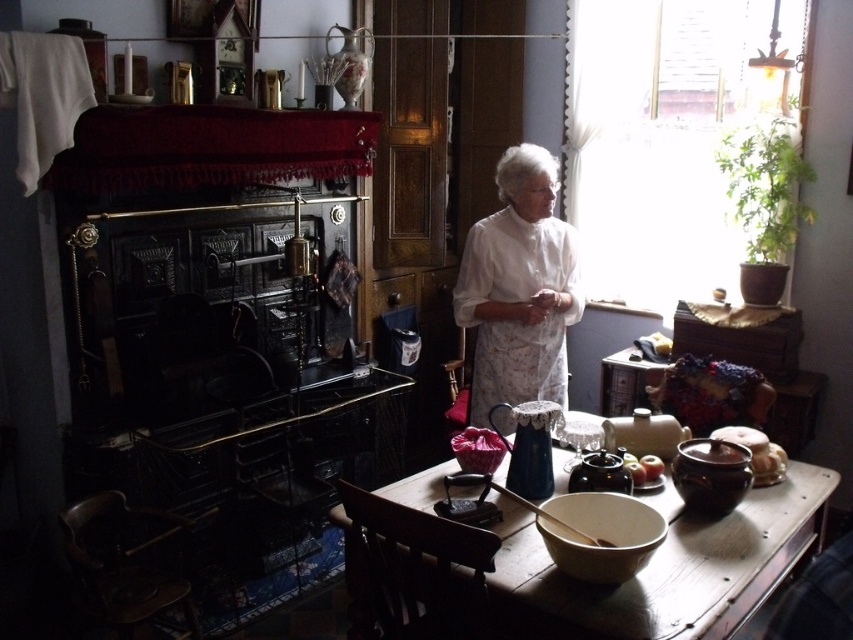
Who is shorter, matte wooden table at center or smooth brown bowl at lower center?

smooth brown bowl at lower center is shorter.

Which is in front, point (688, 579) or point (650, 454)?

Point (688, 579)

At what (x,y) coordinates should I click in order to perform the action: click on matte wooden table at center. Please return your answer as a coordinate pair (x, y). The height and width of the screenshot is (640, 853). Looking at the image, I should click on (665, 566).

Can you confirm if matte wooden table at center is positioned below white lace dress at center?

Yes, matte wooden table at center is below white lace dress at center.

Who is higher up, matte wooden table at center or white lace dress at center?

white lace dress at center

This screenshot has width=853, height=640. Describe the element at coordinates (665, 566) in the screenshot. I see `matte wooden table at center` at that location.

This screenshot has height=640, width=853. Find the location of `matte wooden table at center`. matte wooden table at center is located at coordinates (665, 566).

Can you confirm if white lace dress at center is smaller than smooth brown bowl at lower center?

Actually, white lace dress at center might be larger than smooth brown bowl at lower center.

Can you confirm if white lace dress at center is taller than smooth brown bowl at lower center?

Yes, white lace dress at center is taller than smooth brown bowl at lower center.

Measure the distance between point (544, 346) and camera.

Point (544, 346) and camera are 2.81 meters apart.

Locate an element on the screen. white lace dress at center is located at coordinates 519,288.